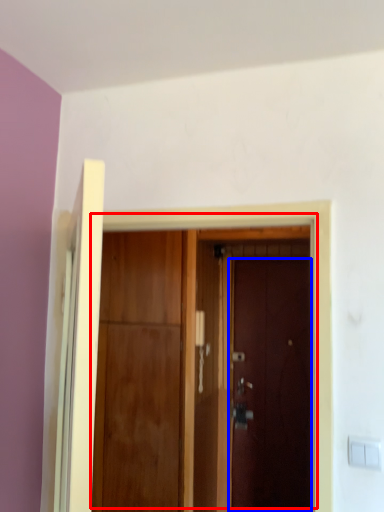
Question: Which object is closer to the camera taking this photo, door (highlighted by a red box) or door (highlighted by a blue box)?

Choices:
 (A) door
 (B) door

Answer: (A)